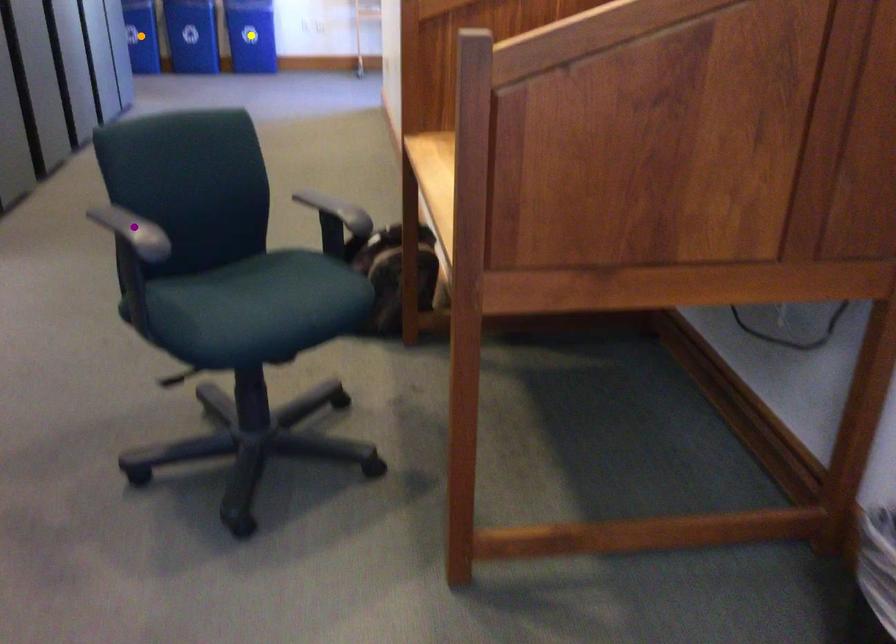
From the picture: Order these from nearest to farthest:
- purple point
- orange point
- yellow point

purple point
orange point
yellow point